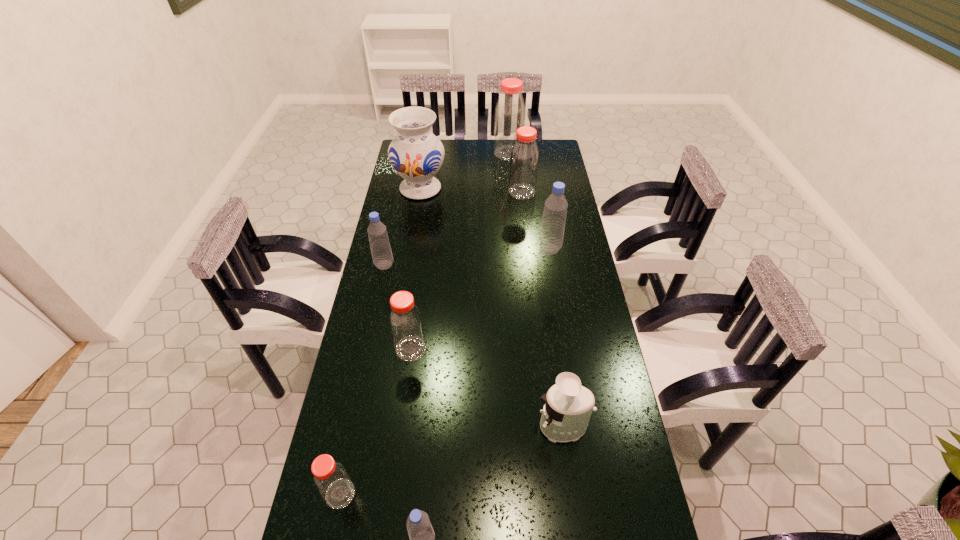
Locate an element on the screen. The width and height of the screenshot is (960, 540). free spot between the second smallest blue bottle and the farthest bottle is located at coordinates (446, 209).

I want to click on vacant space that is in between the second biggest blue bottle and the red vase, so click(x=402, y=227).

Image resolution: width=960 pixels, height=540 pixels. What are the coordinates of `vacant area between the red vase and the third farthest red bottle` in the screenshot? It's located at (416, 269).

In order to click on free point between the second nearest object and the sixth nearest bottle in this screenshot , I will do pyautogui.click(x=431, y=343).

Find the location of a particular element. The height and width of the screenshot is (540, 960). blank region between the farthest blue bottle and the second smallest blue bottle is located at coordinates (467, 257).

This screenshot has height=540, width=960. I want to click on object that is the sixth closest to the nearest bottle, so click(x=416, y=154).

Find the location of a particular element. object that can be found as the fifth closest to the red vase is located at coordinates (405, 320).

You are a GUI agent. You are given a task and a screenshot of the screen. Output one action in this format:
    pyautogui.click(x=<x>, y=<y>)
    Task: Click on the fourth closest bottle to the fourth nearest bottle
    The image size is (960, 540).
    Given the screenshot: What is the action you would take?
    pyautogui.click(x=332, y=481)

Where is `bottle that is the nearest to the third nearest object`? The height and width of the screenshot is (540, 960). bottle that is the nearest to the third nearest object is located at coordinates (422, 537).

Where is `the fourth closest red bottle to the second nearest blue bottle`? The width and height of the screenshot is (960, 540). the fourth closest red bottle to the second nearest blue bottle is located at coordinates (510, 113).